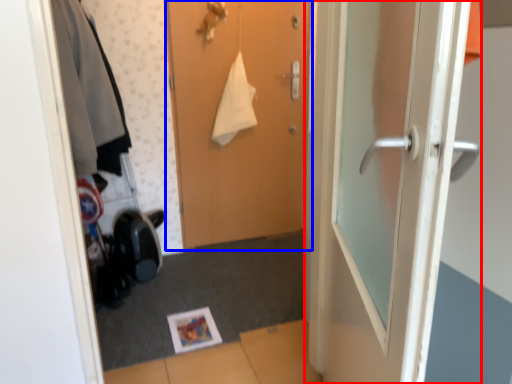
Question: Which of the following is the closest to the observer, door (highlighted by a red box) or door (highlighted by a blue box)?

Choices:
 (A) door
 (B) door

Answer: (A)